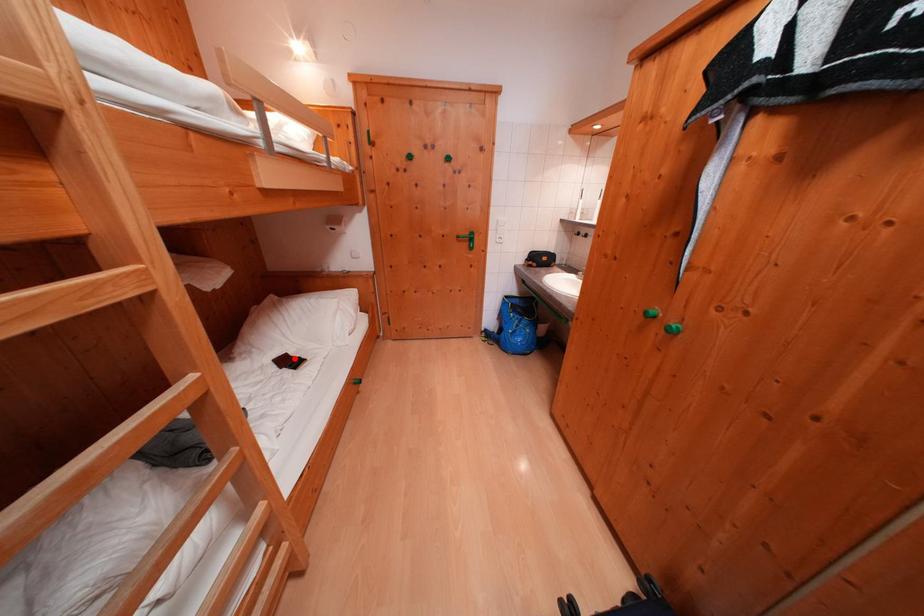
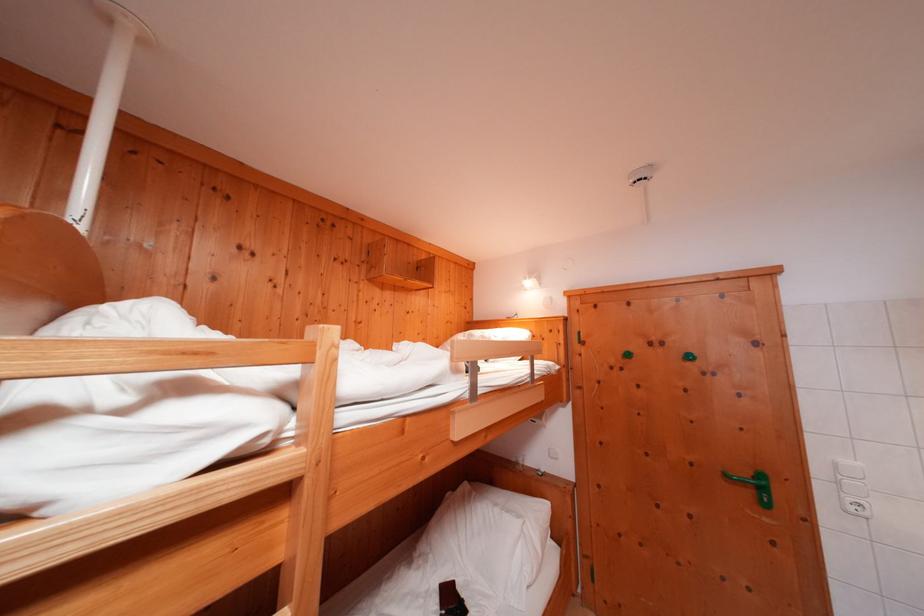
The point at the highlighted location is marked in the first image. Where is the corresponding point in the second image?

(463, 586)